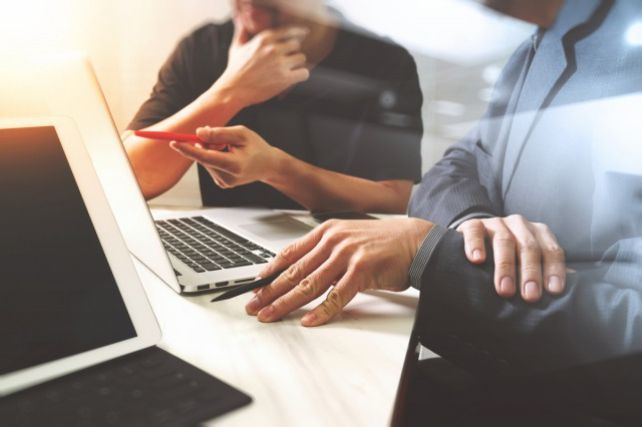
At what (x,y) coordinates should I click in order to perform the action: click on pens. Please return your answer as a coordinate pair (x, y). This screenshot has width=642, height=427. Looking at the image, I should click on (246, 287), (177, 132).